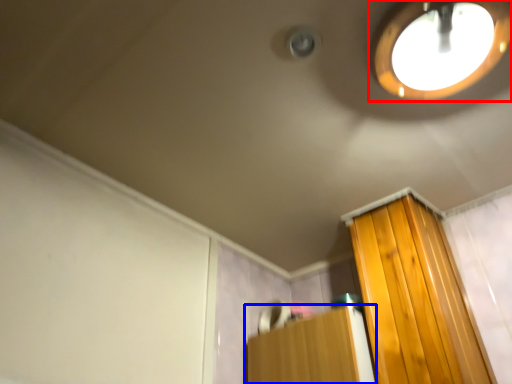
Question: Which object appears farthest to the camera in this image, droplight (highlighted by a red box) or furniture (highlighted by a blue box)?

Choices:
 (A) droplight
 (B) furniture

Answer: (B)